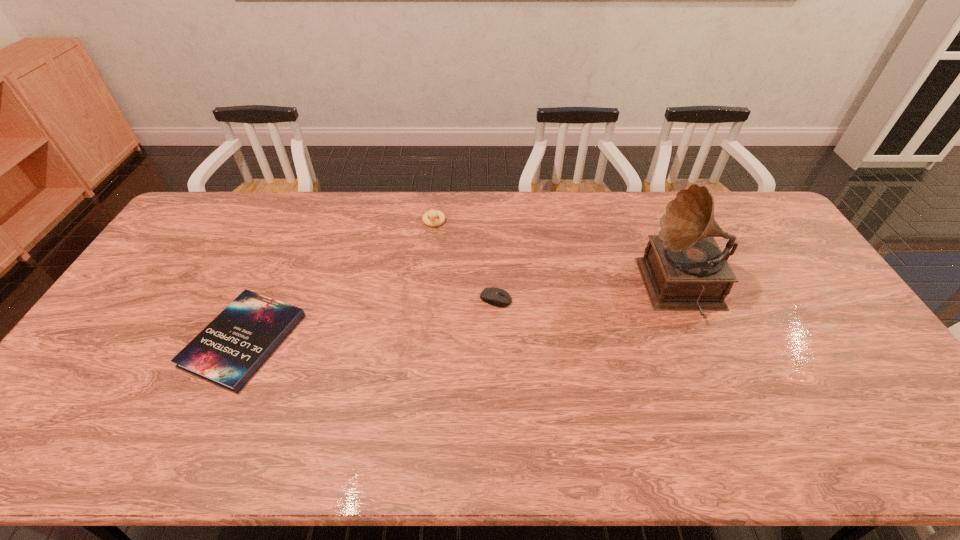
Where is `the tallest object`? Image resolution: width=960 pixels, height=540 pixels. the tallest object is located at coordinates (683, 269).

I want to click on the rightmost object, so click(683, 269).

Where is `duckling`? This screenshot has width=960, height=540. duckling is located at coordinates (432, 214).

The height and width of the screenshot is (540, 960). What are the coordinates of `the third object from right to left` in the screenshot? It's located at (432, 214).

This screenshot has width=960, height=540. I want to click on computer equipment, so click(x=497, y=297).

At what (x,y) coordinates should I click in order to perform the action: click on the shortest object. Please return your answer as a coordinate pair (x, y). Looking at the image, I should click on (230, 349).

The image size is (960, 540). What are the coordinates of `hardback book` in the screenshot? It's located at (230, 349).

The width and height of the screenshot is (960, 540). I want to click on vacant space located 0.090m from the horn of the rightmost object, so click(616, 289).

Identify the location of blank space located from the horn of the rightmost object. Image resolution: width=960 pixels, height=540 pixels. (570, 289).

Identify the location of free spot located from the horn of the rightmost object. (517, 289).